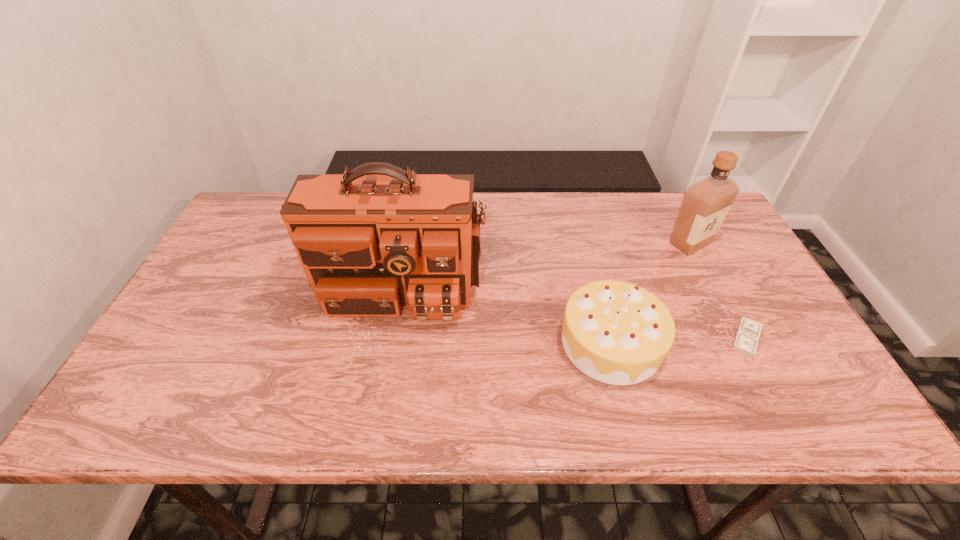
Locate an element on the screen. vacant space that satisfies the following two spatial constraints: 1. on the front-facing side of the money; 2. on the left side of the second tallest object is located at coordinates (739, 339).

What are the coordinates of `free point that satisfies the following two spatial constraints: 1. on the front-facing side of the money; 2. on the left side of the second tallest object` in the screenshot? It's located at (739, 339).

You are a GUI agent. You are given a task and a screenshot of the screen. Output one action in this format:
    pyautogui.click(x=<x>, y=<y>)
    Task: Click on the free location that satisfies the following two spatial constraints: 1. on the face side of the leftmost object; 2. on the left side of the third tallest object
    This screenshot has width=960, height=540.
    Given the screenshot: What is the action you would take?
    pyautogui.click(x=389, y=343)

Find the location of `vacant area in the image that satisfies the following two spatial constraints: 1. on the front-facing side of the shortest object; 2. on the left side of the second tallest object`. vacant area in the image that satisfies the following two spatial constraints: 1. on the front-facing side of the shortest object; 2. on the left side of the second tallest object is located at coordinates (739, 339).

This screenshot has height=540, width=960. I want to click on free spot that satisfies the following two spatial constraints: 1. on the back side of the money; 2. on the left side of the third tallest object, so click(x=610, y=339).

Locate an element on the screen. Image resolution: width=960 pixels, height=540 pixels. blank space that satisfies the following two spatial constraints: 1. on the front-facing side of the second tallest object; 2. on the right side of the shortest object is located at coordinates (739, 339).

This screenshot has width=960, height=540. What are the coordinates of `vacant space that satisfies the following two spatial constraints: 1. on the face side of the satchel; 2. on the left side of the third object from right to left` in the screenshot? It's located at (389, 343).

This screenshot has height=540, width=960. Find the location of `blank space that satisfies the following two spatial constraints: 1. on the front-facing side of the liquor; 2. on the left side of the shortest object`. blank space that satisfies the following two spatial constraints: 1. on the front-facing side of the liquor; 2. on the left side of the shortest object is located at coordinates (739, 339).